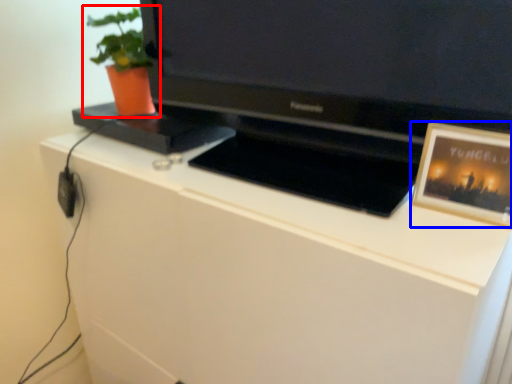
Question: Which of the following is the closest to the observer, houseplant (highlighted by a red box) or picture frame (highlighted by a blue box)?

Choices:
 (A) houseplant
 (B) picture frame

Answer: (B)